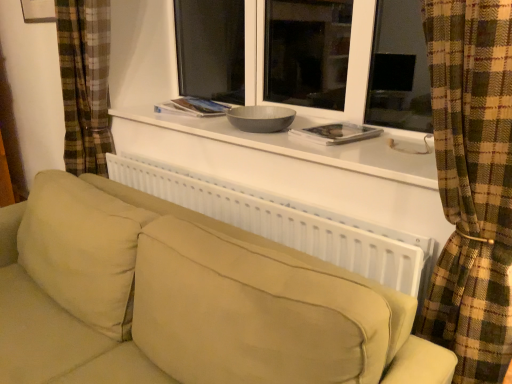
Question: Is white plastic radiator at center closer to camera compared to white matte window sill at upper center?

Choices:
 (A) no
 (B) yes

Answer: (A)

Question: Would you say white plastic radiator at center contains white matte window sill at upper center?

Choices:
 (A) yes
 (B) no

Answer: (B)

Question: From the image's perspective, would you say white plastic radiator at center is shown under white matte window sill at upper center?

Choices:
 (A) yes
 (B) no

Answer: (A)

Question: Is white plastic radiator at center beside white matte window sill at upper center?

Choices:
 (A) yes
 (B) no

Answer: (B)

Question: Is the depth of white plastic radiator at center greater than that of white matte window sill at upper center?

Choices:
 (A) yes
 (B) no

Answer: (A)

Question: Considering the positions of white plastic radiator at center and white paper book at center, placed as the second book when sorted from back to front, in the image, is white plastic radiator at center taller or shorter than white paper book at center, placed as the second book when sorted from back to front,?

Choices:
 (A) short
 (B) tall

Answer: (B)

Question: In the image, is white plastic radiator at center on the left side or the right side of white paper book at center, marked as the 2th book in a left-to-right arrangement?

Choices:
 (A) right
 (B) left

Answer: (B)

Question: Is white plastic radiator at center inside or outside of white paper book at center, marked as the first book in a bottom-to-top arrangement?

Choices:
 (A) outside
 (B) inside

Answer: (A)

Question: Is white plastic radiator at center in front of or behind white paper book at center, which ranks as the 1th book in right-to-left order, in the image?

Choices:
 (A) front
 (B) behind

Answer: (A)

Question: Does point (198, 99) appear closer or farther from the camera than point (173, 167)?

Choices:
 (A) closer
 (B) farther

Answer: (B)

Question: Considering the positions of hardcover book at center, positioned as the 2th book in right-to-left order, and white plastic radiator at center in the image, is hardcover book at center, positioned as the 2th book in right-to-left order, bigger or smaller than white plastic radiator at center?

Choices:
 (A) small
 (B) big

Answer: (A)

Question: From a real-world perspective, is hardcover book at center, the 1th book positioned from the back, positioned above or below white plastic radiator at center?

Choices:
 (A) above
 (B) below

Answer: (A)

Question: In terms of height, does hardcover book at center, the 1th book positioned from the back, look taller or shorter compared to white plastic radiator at center?

Choices:
 (A) tall
 (B) short

Answer: (B)

Question: Is white matte window sill at upper center wider or thinner than beige fabric couch at center?

Choices:
 (A) thin
 (B) wide

Answer: (A)

Question: From the image's perspective, is white matte window sill at upper center positioned above or below beige fabric couch at center?

Choices:
 (A) below
 (B) above

Answer: (B)